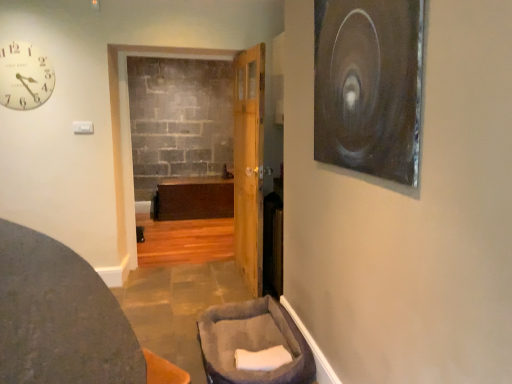
Question: Is matte white clock at upper left facing away from dark gray fabric ottoman at lower left, which is the second furniture in right-to-left order?

Choices:
 (A) no
 (B) yes

Answer: (A)

Question: From the image's perspective, does matte white clock at upper left appear higher than dark gray fabric ottoman at lower left, the first furniture positioned from the left?

Choices:
 (A) no
 (B) yes

Answer: (B)

Question: Does matte white clock at upper left have a larger size compared to dark gray fabric ottoman at lower left, the first furniture positioned from the left?

Choices:
 (A) yes
 (B) no

Answer: (B)

Question: From a real-world perspective, is matte white clock at upper left located beneath dark gray fabric ottoman at lower left, which is the second furniture in right-to-left order?

Choices:
 (A) no
 (B) yes

Answer: (A)

Question: Is matte white clock at upper left positioned before dark gray fabric ottoman at lower left, which is the second furniture in right-to-left order?

Choices:
 (A) yes
 (B) no

Answer: (B)

Question: Could you tell me if matte white clock at upper left is turned towards dark gray fabric ottoman at lower left, the first furniture positioned from the left?

Choices:
 (A) no
 (B) yes

Answer: (A)

Question: Is matte white clock at upper left shorter than metallic silver circular object at upper right?

Choices:
 (A) yes
 (B) no

Answer: (A)

Question: Is the depth of matte white clock at upper left greater than that of metallic silver circular object at upper right?

Choices:
 (A) yes
 (B) no

Answer: (A)

Question: From the image's perspective, is matte white clock at upper left under metallic silver circular object at upper right?

Choices:
 (A) no
 (B) yes

Answer: (A)

Question: Can you confirm if matte white clock at upper left is bigger than metallic silver circular object at upper right?

Choices:
 (A) no
 (B) yes

Answer: (A)

Question: Would you say metallic silver circular object at upper right is part of matte white clock at upper left's contents?

Choices:
 (A) no
 (B) yes

Answer: (A)

Question: Is matte white clock at upper left far away from metallic silver circular object at upper right?

Choices:
 (A) yes
 (B) no

Answer: (A)

Question: From the image's perspective, is metallic silver circular object at upper right located above gray plush pet bed at lower center, positioned as the 2th furniture in left-to-right order?

Choices:
 (A) no
 (B) yes

Answer: (B)